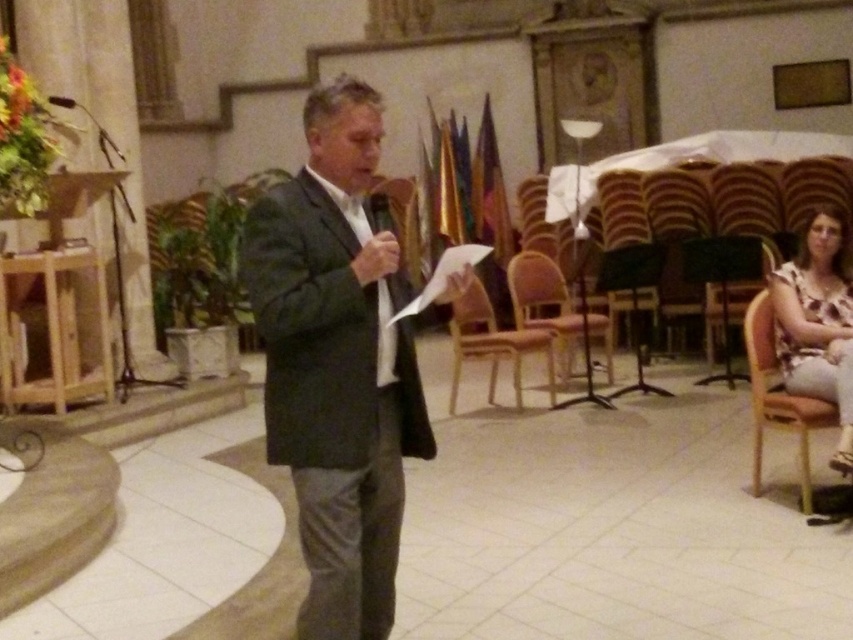
You are attending a formal event and see a printed fabric blouse at right and a light brown wooden chair at center. Which object is located to the right of the other?

The printed fabric blouse at right is positioned on the right side of light brown wooden chair at center.

You are standing in the hall and want to approach the speaker who is holding a piece of paper. The point marked at coordinates (526, 266) is 6.20 meters away from you. Can you estimate how far you are from the speaker?

The point marked at coordinates (526, 266) is 6.20 meters away from you, so you are 6.20 meters away from the speaker.